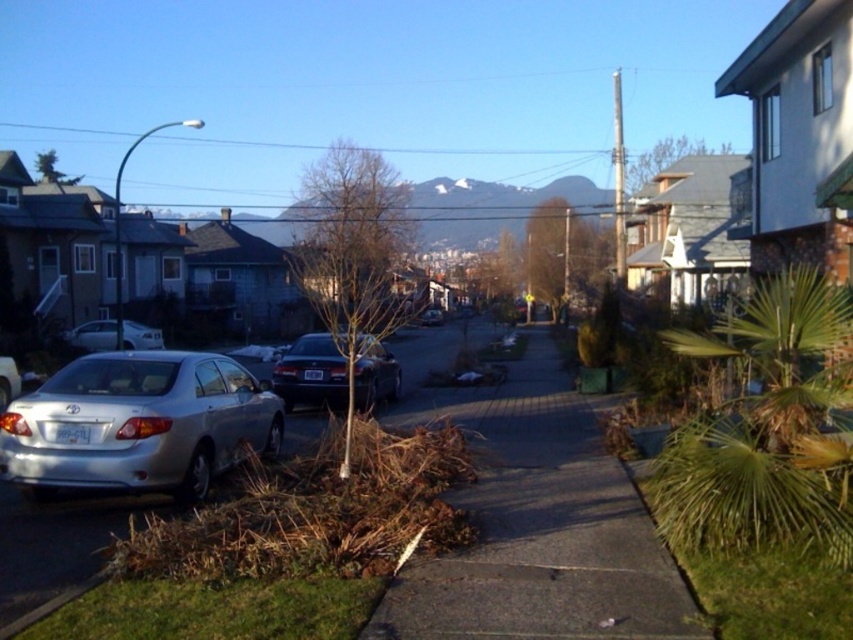
You are a pedestrian standing on the sidewalk and want to cross the street to reach a mailbox located behind the satin silver sedan at left. Can you step onto the concrete sidewalk at center to get closer to the sedan?

The concrete sidewalk at center is in front of the satin silver sedan at left, so stepping onto it would place you closer to the sedan, allowing you to reach the mailbox behind it.

You are a pedestrian walking along the sidewalk and want to cross the street to reach a friend waiting on the opposite side. The street has a parked satin silver sedan at left. To avoid the car, should you walk to the right or left of the concrete sidewalk at center relative to the sedan?

You should walk to the right of the satin silver sedan at left because the concrete sidewalk at center is located to the right of the sedan, providing a clear path away from the parked car.